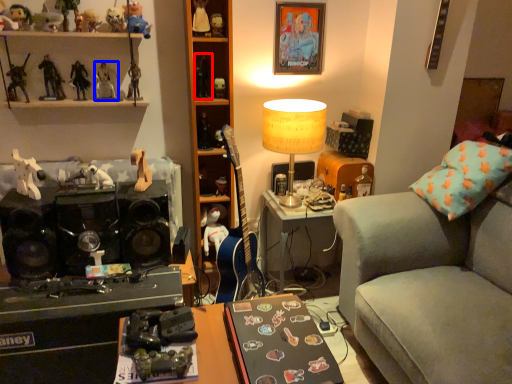
Question: Which point is closer to the camera, toy (highlighted by a red box) or toy (highlighted by a blue box)?

Choices:
 (A) toy
 (B) toy

Answer: (B)